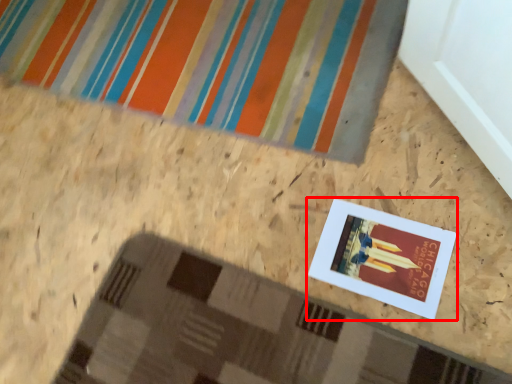
Question: From the image's perspective, considering the relative positions of picture frame (annotated by the red box) and bath mat in the image provided, where is picture frame (annotated by the red box) located with respect to the staircase?

Choices:
 (A) above
 (B) below

Answer: (B)